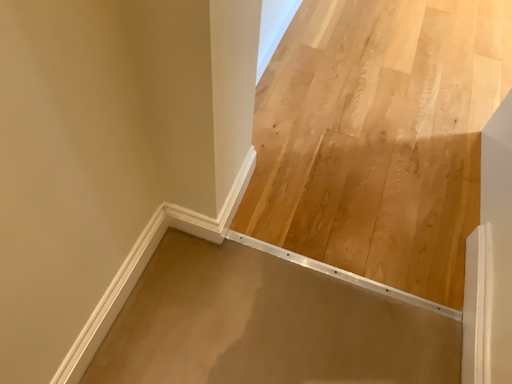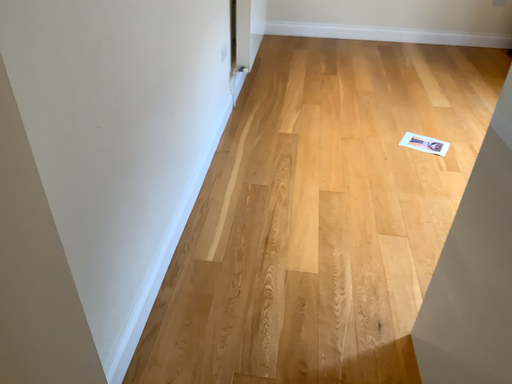
Question: How did the camera likely rotate when shooting the video?

Choices:
 (A) rotated upward
 (B) rotated downward

Answer: (A)